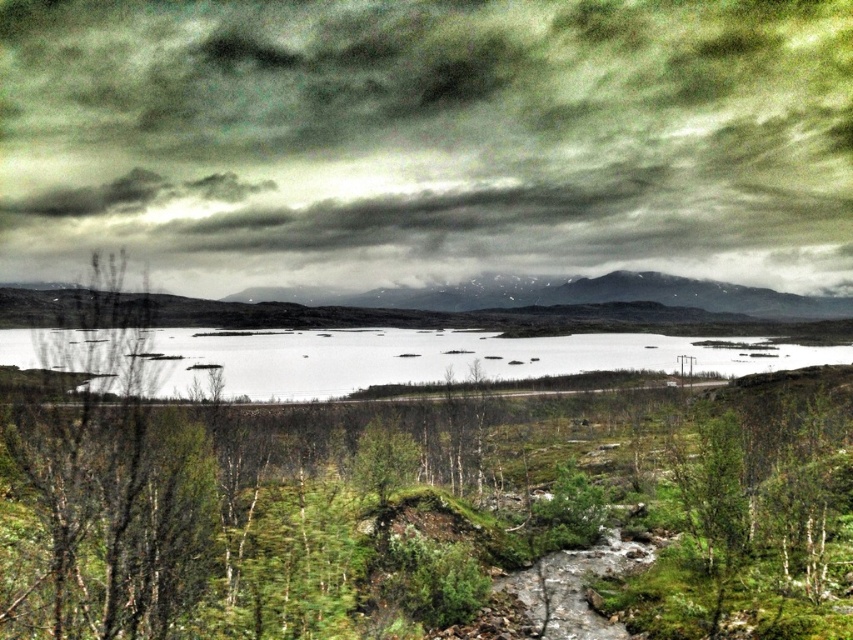
You are standing in the landscape scene and want to determine which object occupies more vertical space in the image. Based on the cloudy sky at upper center and the green leafy shrubs at center, which one appears taller?

The cloudy sky at upper center appears taller than the green leafy shrubs at center.